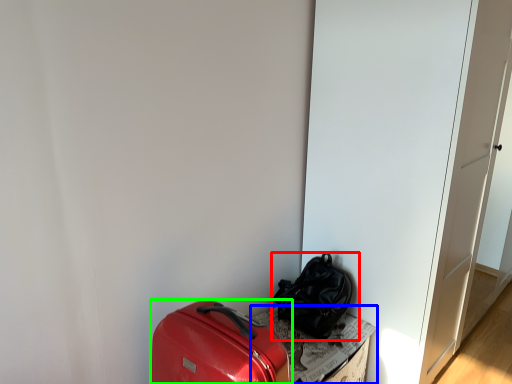
Question: Based on their relative distances, which object is farther from luggage and bags (highlighted by a red box)? Choose from cardboard box (highlighted by a blue box) and luggage and bags (highlighted by a green box).

Choices:
 (A) cardboard box
 (B) luggage and bags

Answer: (B)